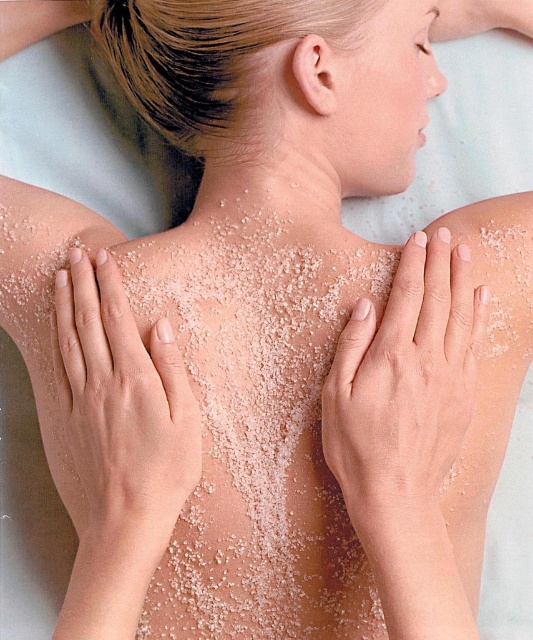
Question: Is smooth skin at upper center to the left of smooth skin at left from the viewer's perspective?

Choices:
 (A) yes
 (B) no

Answer: (B)

Question: Which object is closer to the camera taking this photo?

Choices:
 (A) smooth skin at left
 (B) smooth skin at upper center

Answer: (A)

Question: Does smooth skin at upper center have a smaller size compared to white granular skin at center?

Choices:
 (A) no
 (B) yes

Answer: (A)

Question: Which object is positioned farthest from the smooth skin at left?

Choices:
 (A) white granular skin at center
 (B) smooth skin at upper center

Answer: (A)

Question: Is smooth skin at upper center wider than white granular skin at center?

Choices:
 (A) no
 (B) yes

Answer: (B)

Question: Which point is farther to the camera?

Choices:
 (A) (179, 204)
 (B) (165, 458)
 (C) (377, 476)

Answer: (A)